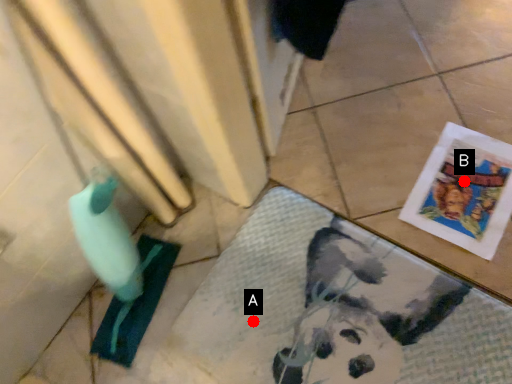
Question: Two points are circled on the image, labeled by A and B beside each circle. Which point is farther to the camera?

Choices:
 (A) A is further
 (B) B is further

Answer: (B)